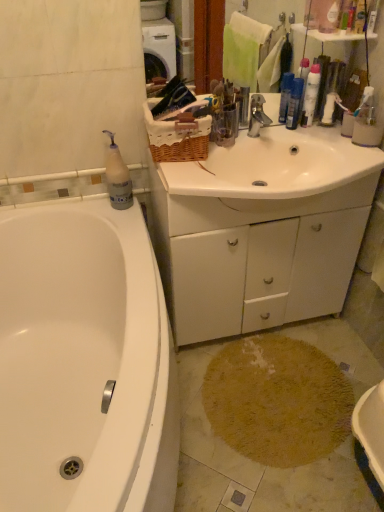
You are a GUI agent. You are given a task and a screenshot of the screen. Output one action in this format:
    pyautogui.click(x=<x>, y=<y>)
    Task: Click on the vacant area situated below beige shaggy rug at lower center (from a real-world perspective)
    This screenshot has height=512, width=384.
    Given the screenshot: What is the action you would take?
    pyautogui.click(x=246, y=396)